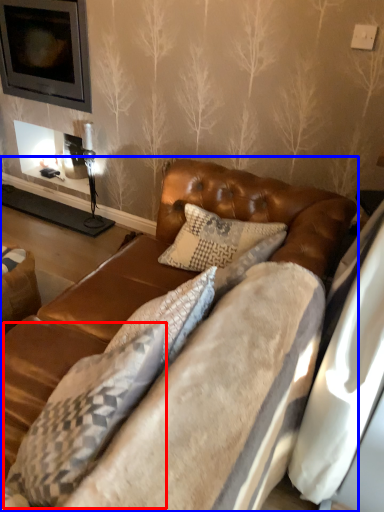
Question: Among these objects, which one is nearest to the camera, pillow (highlighted by a red box) or studio couch (highlighted by a blue box)?

Choices:
 (A) pillow
 (B) studio couch

Answer: (B)